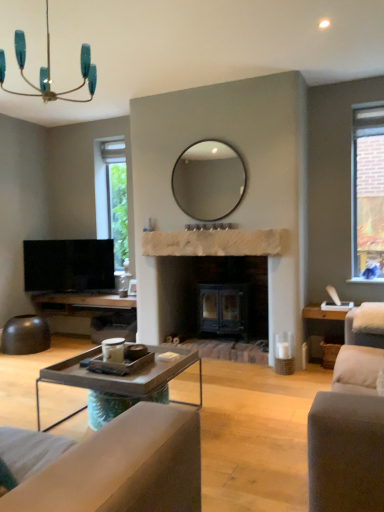
At what (x,y) coordinates should I click in order to perform the action: click on vacant region to the right of metallic gray coffee table at lower center. Please return your answer as a coordinate pair (x, y). The image size is (384, 512). Looking at the image, I should click on (253, 425).